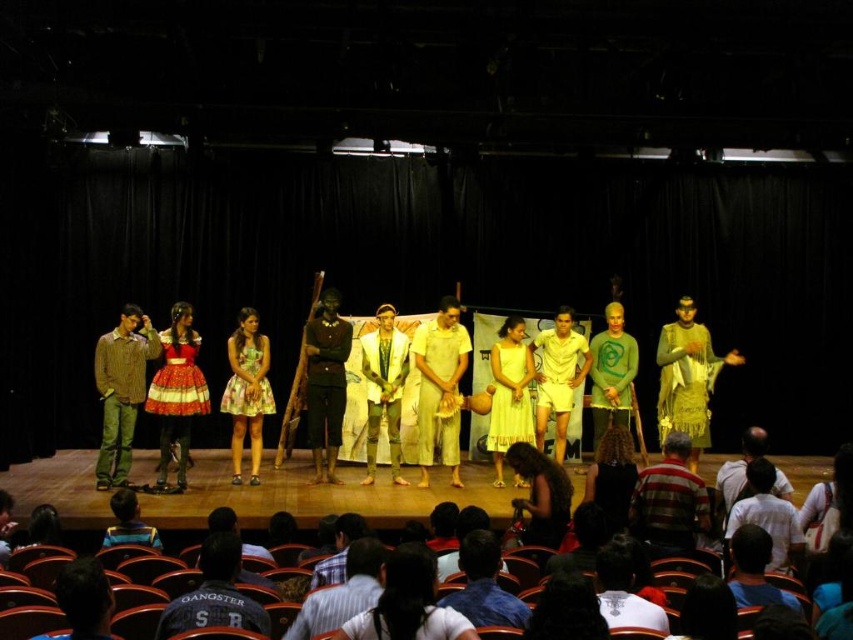
You are a photographer positioned at the back of the theater. You want to capture a photo of the two performers wearing the light yellow fabric dress at center and the matte red and white dress at center. Which dress should you focus on first if you want to capture the one that is positioned to the right of the other?

The light yellow fabric dress at center is to the right of the matte red and white dress at center, so you should focus on the light yellow fabric dress at center first to capture its position relative to the other.

You are sitting in the front row of the theater. You want to see the light yellow fabric dress at center clearly. Is it close enough for you to see details like the fabric texture?

The light yellow fabric dress at center is 8.41 meters away from the viewer. In a typical theater setting, this distance may make it difficult to see fine details like fabric texture clearly from the front row.

You are an audience member sitting in the front row of the theater. You notice two points marked on the stage floor. The first point is at coordinates point (444, 454) and the second is at point (165, 412). Which point is closer to you?

Point (444, 454) is closer to you because it is further to the viewer than point (165, 412).